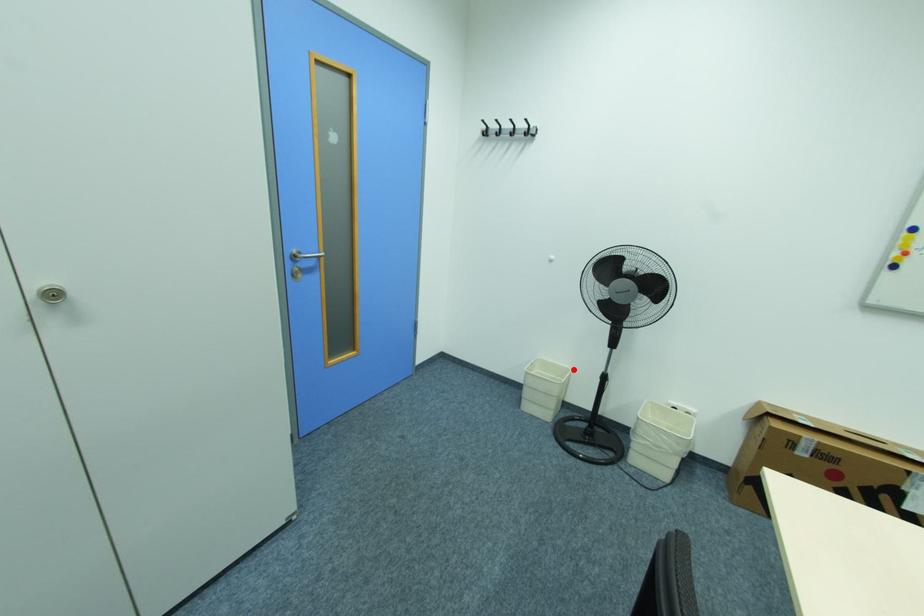
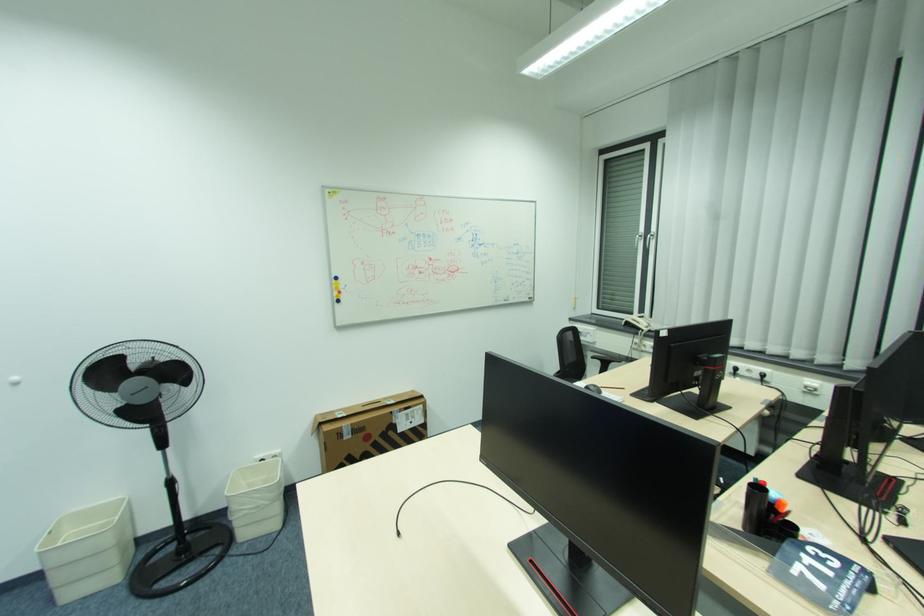
Locate, in the second image, the point that corresponds to the highlighted location in the first image.

(128, 500)